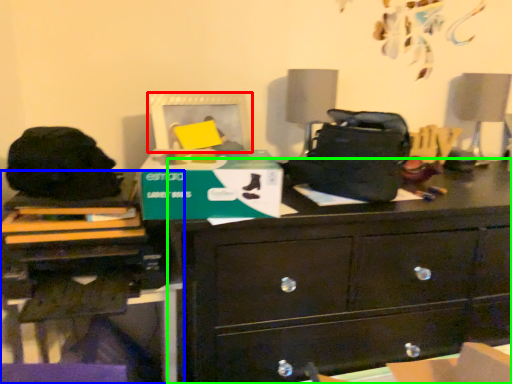
Question: Based on their relative distances, which object is farther from picture frame (highlighted by a red box)? Choose from computer desk (highlighted by a blue box) and chest of drawers (highlighted by a green box).

Choices:
 (A) computer desk
 (B) chest of drawers

Answer: (B)